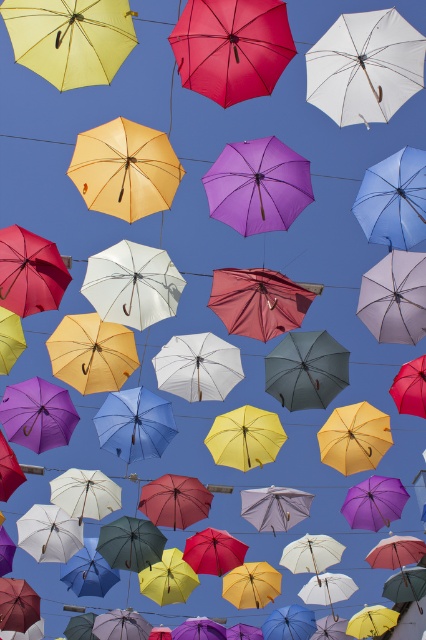
You are standing in a park where the umbrellas are displayed. You want to find the matte yellow umbrella at center. According to the coordinates given, where should you look relative to the image frame?

The matte yellow umbrella at center is located at the coordinates point (124, 170), which is slightly to the left and slightly below the center of the image frame.

You are standing in front of the suspended umbrellas display and want to determine which of the two points, point (98, 138) or point (284, 177), is nearer to you. Based on the scene description, which point is closer?

Point (98, 138) is closer to the viewer than point (284, 177).